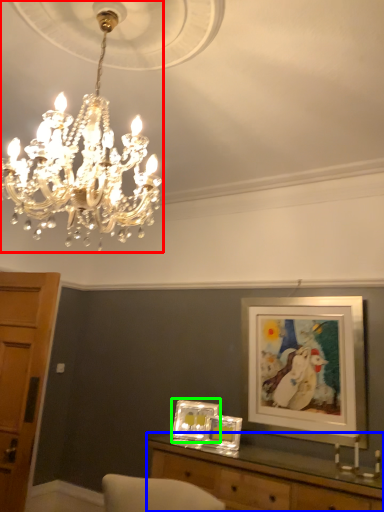
Question: Considering the real-world distances, which object is closest to lamp (highlighted by a red box)? table (highlighted by a blue box) or picture frame (highlighted by a green box).

Choices:
 (A) table
 (B) picture frame

Answer: (A)